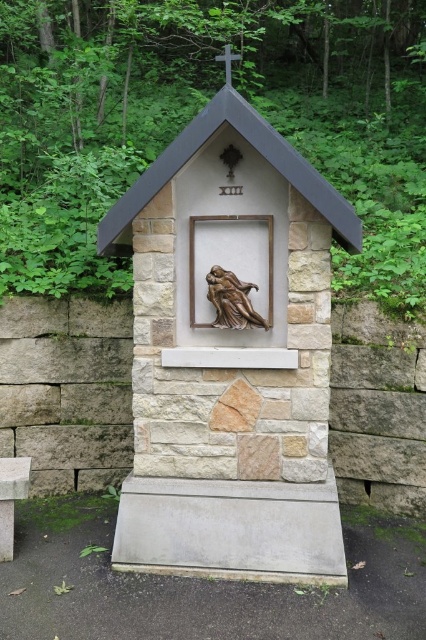
Question: Does bronze statue at center come in front of bronze sculpture at center?

Choices:
 (A) no
 (B) yes

Answer: (B)

Question: Does bronze statue at center appear over bronze sculpture at center?

Choices:
 (A) yes
 (B) no

Answer: (B)

Question: Among these objects, which one is farthest from the camera?

Choices:
 (A) bronze statue at center
 (B) bronze sculpture at center

Answer: (B)

Question: Which point is farther to the camera?

Choices:
 (A) (253, 323)
 (B) (268, 435)

Answer: (A)

Question: Is bronze statue at center below bronze sculpture at center?

Choices:
 (A) yes
 (B) no

Answer: (A)

Question: Which of the following is the farthest from the observer?

Choices:
 (A) bronze sculpture at center
 (B) bronze statue at center

Answer: (A)